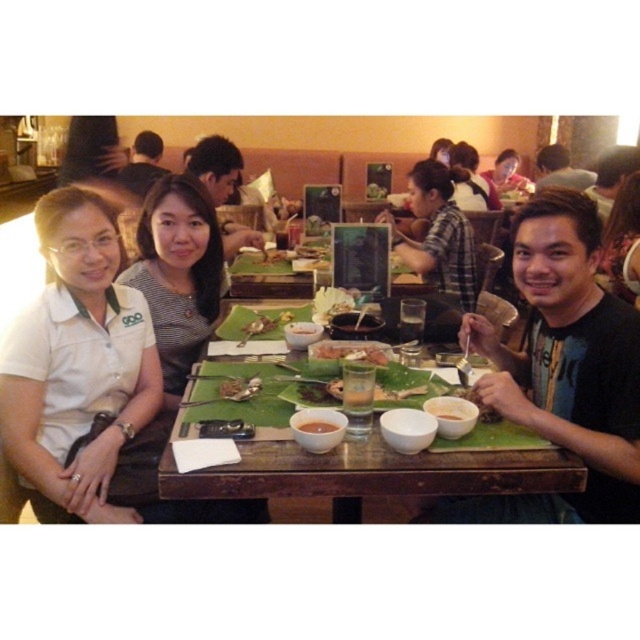
You are a person sitting at the table in the scene. You want to reach for the point at coordinate (436, 234). Which object on the table is closest to that point?

The point at coordinate (436, 234) is on the plaid shirt at center, so the closest object to that point is the plaid shirt at center.

You are a server at the restaurant and need to place a new dish on the table. The dish is quite large and requires a clear space. Which item on the table should you move to make room? Please choose between the white shirt at center and the matte pink shirt at upper center.

The matte pink shirt at upper center occupies more space than the white shirt at center, so you should move the matte pink shirt at upper center to make room for the large dish.